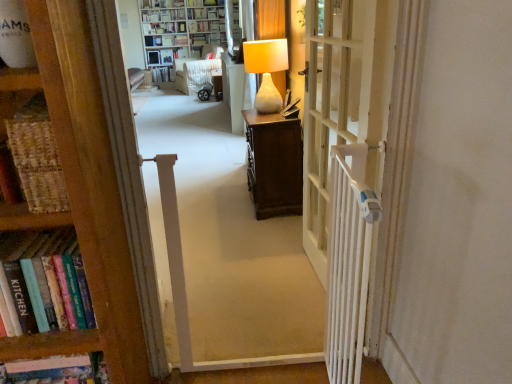
Where is `matte white shelf at upper center`? matte white shelf at upper center is located at coordinates (164, 56).

What do you see at coordinates (82, 193) in the screenshot? The image size is (512, 384). I see `wooden bookcase at left, which ranks as the 1th bookcase in bottom-to-top order` at bounding box center [82, 193].

Find the location of `matte white lamp at center, placed as the 1th furniture when sorted from front to back`. matte white lamp at center, placed as the 1th furniture when sorted from front to back is located at coordinates (237, 91).

The image size is (512, 384). What are the coordinates of `hardcover book at upper center, the second book positioned from the top` in the screenshot? It's located at click(164, 28).

The height and width of the screenshot is (384, 512). What do you see at coordinates (164, 28) in the screenshot?
I see `hardcover book at upper center, which is the second book in bottom-to-top order` at bounding box center [164, 28].

This screenshot has width=512, height=384. Identify the location of matte white shelf at upper center. (164, 56).

From a real-world perspective, between hardcover book at upper center, arranged as the third book when ordered from the bottom, and white glossy bookcase at upper center, which is the first bookcase from top to bottom, who is vertically lower?

In real-world perspective, white glossy bookcase at upper center, which is the first bookcase from top to bottom, is lower.

Starting from the hardcover book at upper center, the 1th book viewed from the top, which bookcase is the 1st one to the right? Please provide its 2D coordinates.

[(179, 32)]

Considering the sizes of objects hardcover book at upper center, the 1th book viewed from the top, and white glossy bookcase at upper center, the 2th bookcase positioned from the front, in the image provided, who is smaller, hardcover book at upper center, the 1th book viewed from the top, or white glossy bookcase at upper center, the 2th bookcase positioned from the front,?

hardcover book at upper center, the 1th book viewed from the top.

Is hardcover book at upper center, which is the second book in bottom-to-top order, far from matte white shelf at upper center?

That's not correct — hardcover book at upper center, which is the second book in bottom-to-top order, is a little close to matte white shelf at upper center.

Considering the relative positions of hardcover book at upper center, which is the second book in bottom-to-top order, and matte white shelf at upper center in the image provided, is hardcover book at upper center, which is the second book in bottom-to-top order, to the right of matte white shelf at upper center from the viewer's perspective?

Incorrect, hardcover book at upper center, which is the second book in bottom-to-top order, is not on the right side of matte white shelf at upper center.

Can you tell me how much hardcover book at upper center, which is the second book in bottom-to-top order, and matte white shelf at upper center differ in facing direction?

They differ by 4.09 degrees in their facing directions.

From the picture: Is hardcover book at upper center, which is the second book in bottom-to-top order, taller or shorter than matte white shelf at upper center?

Clearly, hardcover book at upper center, which is the second book in bottom-to-top order, is shorter compared to matte white shelf at upper center.

Looking at this image, is velvet beige armchair at center, which is the second furniture in front-to-back order, positioned in front of matte white lamp at center, which ranks as the second furniture in back-to-front order?

No, velvet beige armchair at center, which is the second furniture in front-to-back order, is further to the viewer.

Between point (189, 65) and point (224, 92), which one is positioned in front?

Positioned in front is point (224, 92).

In terms of height, does velvet beige armchair at center, the 1th furniture viewed from the left, look taller or shorter compared to matte white lamp at center, which is the first furniture in right-to-left order?

Clearly, velvet beige armchair at center, the 1th furniture viewed from the left, is taller compared to matte white lamp at center, which is the first furniture in right-to-left order.

The width and height of the screenshot is (512, 384). What are the coordinates of `furniture that is the 1st object directly below the hardcover book at upper center, the second book positioned from the top (from a real-world perspective)` in the screenshot? It's located at (197, 70).

Can you confirm if hardcover book at upper center, the second book positioned from the top, is shorter than velvet beige armchair at center, the 1th furniture viewed from the left?

Yes.

Is hardcover book at upper center, the second book positioned from the top, not near velvet beige armchair at center, placed as the 1th furniture when sorted from back to front?

hardcover book at upper center, the second book positioned from the top, is near velvet beige armchair at center, placed as the 1th furniture when sorted from back to front, not far away.

Considering the relative sizes of matte white lamp at center, acting as the second furniture starting from the left, and white wooden gate at center in the image provided, is matte white lamp at center, acting as the second furniture starting from the left, thinner than white wooden gate at center?

Yes.

Is matte white lamp at center, acting as the second furniture starting from the left, touching white wooden gate at center?

They are not placed beside each other.

Could white wooden gate at center be considered to be inside matte white lamp at center, which ranks as the second furniture in back-to-front order?

No, white wooden gate at center is not inside matte white lamp at center, which ranks as the second furniture in back-to-front order.

Does white wooden door at center come behind hardcover book at upper center, the second book positioned from the top?

No, white wooden door at center is closer to the viewer.

Is white wooden door at center smaller than hardcover book at upper center, the second book positioned from the top?

No.

Is white wooden door at center wider or thinner than hardcover book at upper center, the second book positioned from the top?

Clearly, white wooden door at center has less width compared to hardcover book at upper center, the second book positioned from the top.

Who is taller, white wooden door at center or hardcover book at upper center, the second book positioned from the top?

Standing taller between the two is white wooden door at center.

From a real-world perspective, is matte white lamp at center, placed as the 1th furniture when sorted from front to back, above or below white wooden door at center?

Clearly, from a real-world perspective, matte white lamp at center, placed as the 1th furniture when sorted from front to back, is below white wooden door at center.

Between matte white lamp at center, which is the first furniture in right-to-left order, and white wooden door at center, which one has less height?

Standing shorter between the two is matte white lamp at center, which is the first furniture in right-to-left order.

From the image's perspective, between matte white lamp at center, which is the first furniture in right-to-left order, and white wooden door at center, who is located below?

From the image's view, white wooden door at center is below.

At what (x,y) coordinates should I click in order to perform the action: click on the 2nd book to the left of the white glossy bookcase at upper center, the second bookcase positioned from the bottom, counting from the anchor's position. Please return your answer as a coordinate pair (x, y). This screenshot has height=384, width=512. Looking at the image, I should click on (163, 15).

You are a GUI agent. You are given a task and a screenshot of the screen. Output one action in this format:
    pyautogui.click(x=<x>, y=<y>)
    Task: Click on the shelf that appears behind the hardcover book at upper center, the second book positioned from the top
    
    Given the screenshot: What is the action you would take?
    pyautogui.click(x=164, y=56)

From the image, which object appears to be nearer to white wooden door at center, matte white lamp at center or white glossy bookcase at upper center, which is the first bookcase from top to bottom?

matte white lamp at center lies closer to white wooden door at center than the other object.

Which object lies nearer to the anchor point matte white shelf at upper center, velvet beige armchair at center, placed as the 1th furniture when sorted from back to front, or white wooden gate at center?

Among the two, velvet beige armchair at center, placed as the 1th furniture when sorted from back to front, is located nearer to matte white shelf at upper center.

Which object lies nearer to the anchor point white wooden door at center, matte white shelf at upper center or velvet beige armchair at center, placed as the 1th furniture when sorted from back to front?

velvet beige armchair at center, placed as the 1th furniture when sorted from back to front, is positioned closer to the anchor white wooden door at center.

When comparing their distances from hardcover book at upper center, the 1th book viewed from the top, does hardcover book at center, which is the 3th book in top-to-bottom order, or matte white lamp at center, which ranks as the second furniture in back-to-front order, seem further?

matte white lamp at center, which ranks as the second furniture in back-to-front order.

Which object lies further to the anchor point white wooden door at center, matte white lamp at center, which ranks as the second furniture in back-to-front order, or velvet beige armchair at center, which is the second furniture from right to left?

velvet beige armchair at center, which is the second furniture from right to left, is further to white wooden door at center.

From the image, which object appears to be farther from matte white shelf at upper center, hardcover book at center, which is the 3th book in top-to-bottom order, or matte white lamp at center?

matte white lamp at center is positioned further to the anchor matte white shelf at upper center.

Which object lies nearer to the anchor point hardcover book at upper center, the second book positioned from the top, hardcover book at upper center, arranged as the third book when ordered from the bottom, or white wooden door at center?

hardcover book at upper center, arranged as the third book when ordered from the bottom, lies closer to hardcover book at upper center, the second book positioned from the top, than the other object.

From the image, which object appears to be nearer to white wooden gate at center, velvet beige armchair at center, which is the second furniture in front-to-back order, or hardcover book at center, which is the 3th book in top-to-bottom order?

velvet beige armchair at center, which is the second furniture in front-to-back order, is closer to white wooden gate at center.

At what (x,y) coordinates should I click in order to perform the action: click on corridor positioned between white plastic radiator at right and matte white lamp at center from near to far. Please return your answer as a coordinate pair (x, y). Looking at the image, I should click on (231, 241).

Where is `bookcase between wooden bookcase at left, the second bookcase positioned from the top, and matte white shelf at upper center, along the z-axis`? bookcase between wooden bookcase at left, the second bookcase positioned from the top, and matte white shelf at upper center, along the z-axis is located at coordinates (179, 32).

I want to click on bookcase positioned between matte white lamp at center, acting as the second furniture starting from the left, and hardcover book at center, which is the 3th book in top-to-bottom order, from near to far, so click(179, 32).

Where is `shelf located between matte white lamp at center and hardcover book at center, which is the 3th book in top-to-bottom order, in the depth direction`? This screenshot has height=384, width=512. shelf located between matte white lamp at center and hardcover book at center, which is the 3th book in top-to-bottom order, in the depth direction is located at coordinates [x=164, y=56].